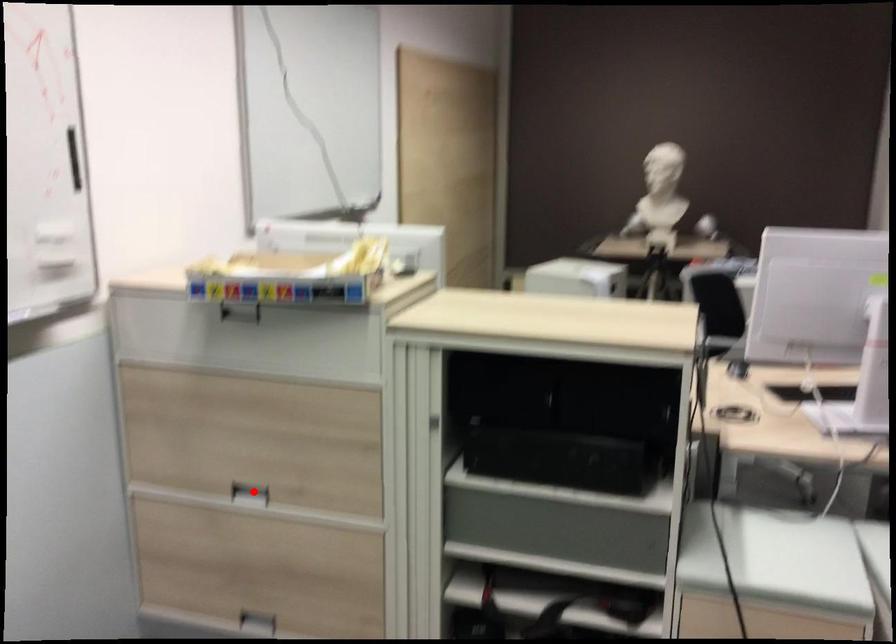
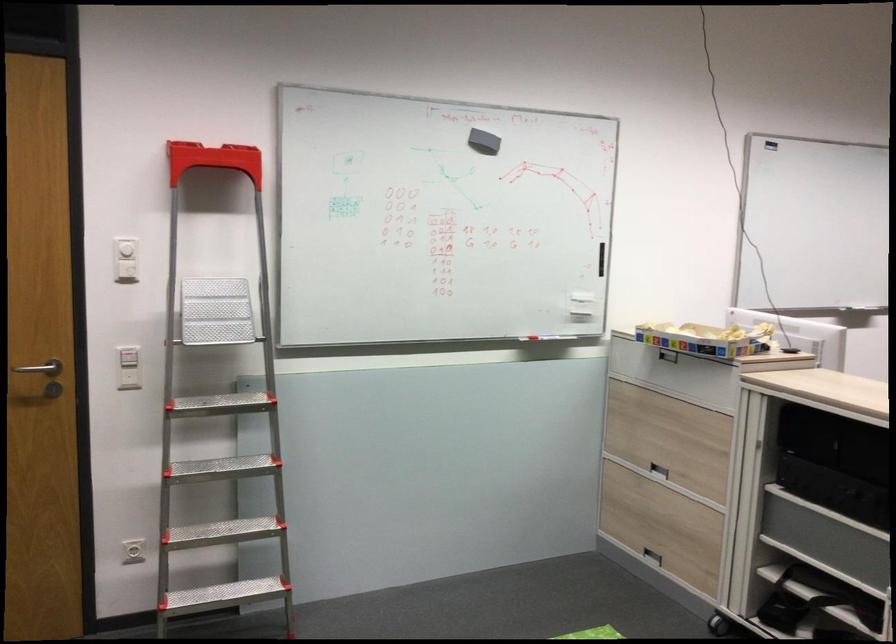
The point at the highlighted location is marked in the first image. Where is the corresponding point in the second image?

(658, 469)